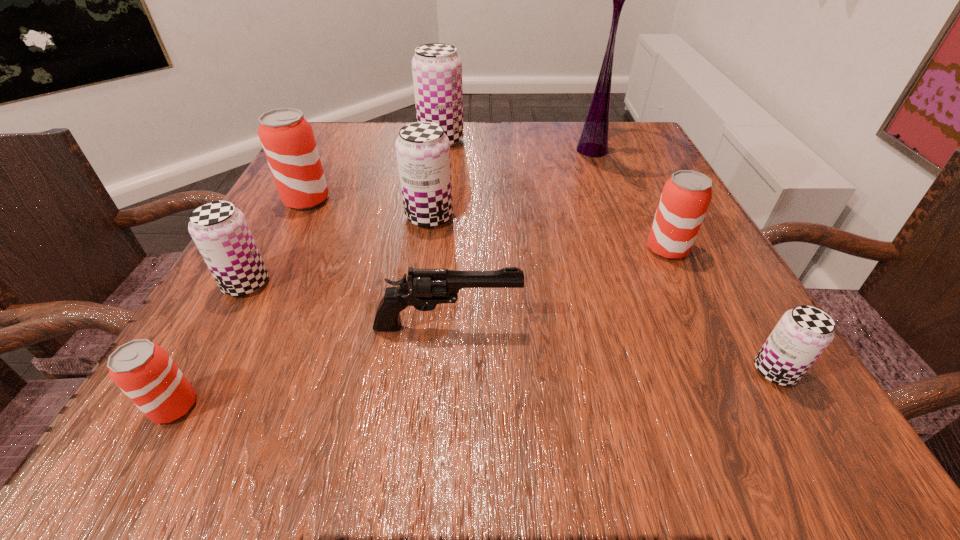
Where is `gun`? Image resolution: width=960 pixels, height=540 pixels. gun is located at coordinates (425, 288).

Image resolution: width=960 pixels, height=540 pixels. Find the location of `the rightmost purple beer can`. the rightmost purple beer can is located at coordinates coord(802,334).

In order to click on the smallest purple beer can in this screenshot , I will do `click(802, 334)`.

Locate an element on the screen. The image size is (960, 540). the nearest orange beer can is located at coordinates (143, 370).

Locate an element on the screen. free point located on the front-facing side of the lampshade is located at coordinates (657, 315).

Where is `free region located on the front of the farthest purple beer can`? The width and height of the screenshot is (960, 540). free region located on the front of the farthest purple beer can is located at coordinates (438, 164).

The width and height of the screenshot is (960, 540). What are the coordinates of `free space located 0.190m on the back of the farthest orange beer can` in the screenshot? It's located at (335, 144).

Identify the location of vacant space located on the back of the third nearest purple beer can. This screenshot has height=540, width=960. (x=443, y=124).

At what (x,y) coordinates should I click in order to perform the action: click on free space located on the front of the rightmost orange beer can. Please return your answer as a coordinate pair (x, y). The height and width of the screenshot is (540, 960). Looking at the image, I should click on (732, 384).

I want to click on free space located 0.370m on the right of the leftmost purple beer can, so click(510, 284).